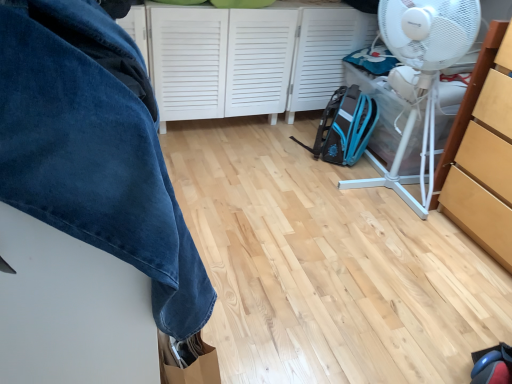
You are a GUI agent. You are given a task and a screenshot of the screen. Output one action in this format:
    pyautogui.click(x=<x>, y=<y>)
    Task: Click on the vacant area in front of white plastic mechanical fan at right
    
    Given the screenshot: What is the action you would take?
    pyautogui.click(x=392, y=253)